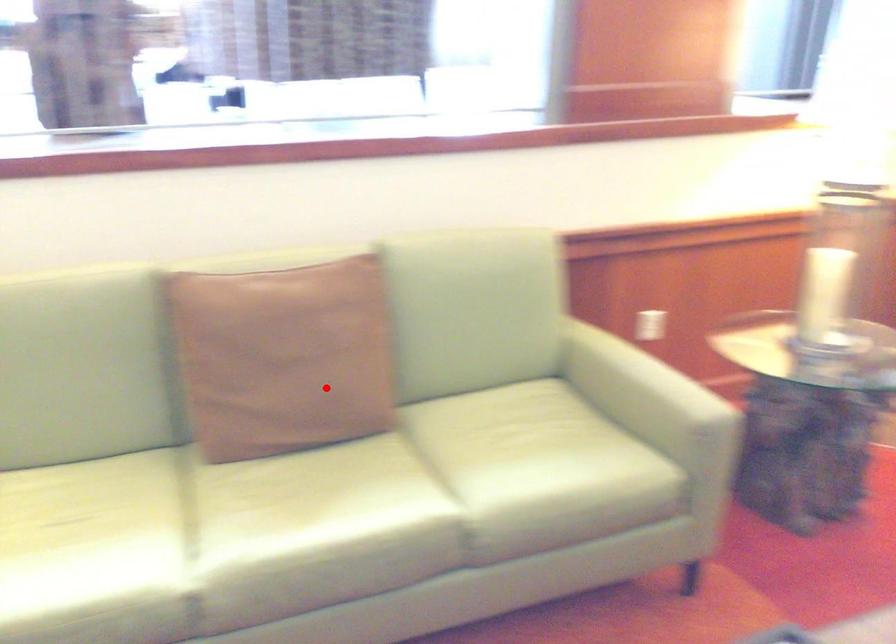
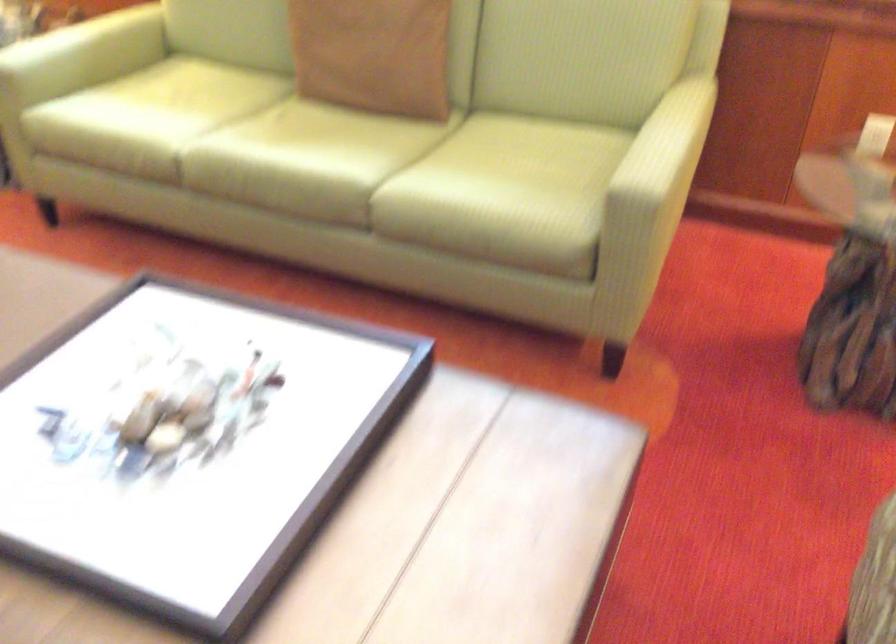
Question: I am providing you with two images of the same scene from different viewpoints. A red point is shown in image1. For the corresponding object point in image2, is it positioned nearer or farther from the camera?

Choices:
 (A) Nearer
 (B) Farther

Answer: (B)